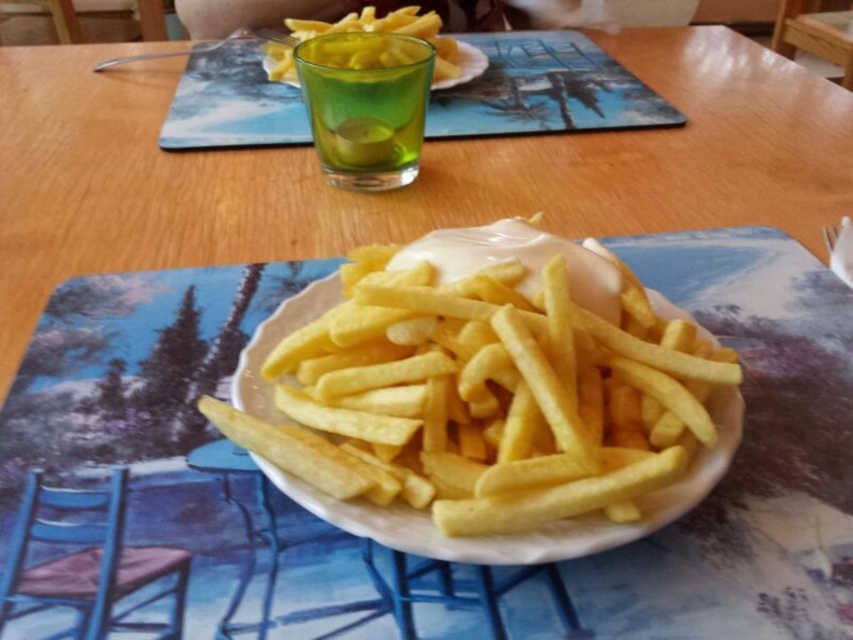
You are a customer at a cafe and you see two plates of fries. One is labeled as golden crispy french fries at center and the other is yellow crispy french fries at upper center. According to the menu, the golden ones are baked while the yellow ones are fried. If you want to choose the baked fries, which plate should you pick?

The golden crispy french fries at center are to the right of the yellow crispy french fries at upper center, so if you want baked fries, you should choose the golden crispy french fries at center.

You are a food critic evaluating this plate of fries. You notice two different types of fries on the plate. Which one is larger in size between the golden crispy french fries at center and the yellow crispy french fries at upper center?

The yellow crispy french fries at upper center is larger than the golden crispy french fries at center.

You are a food delivery robot with a 12 inch wide tray. You need to place your tray between the golden crispy french fries at center and the yellow crispy french fries at upper center on the table. Can your tray fit in that space?

The distance between the golden crispy french fries at center and the yellow crispy french fries at upper center is 13.50 inches, so the 12 inch wide tray can fit in the space between them.